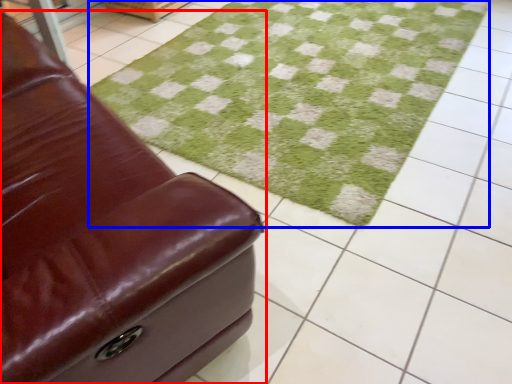
Question: Among these objects, which one is nearest to the camera, furniture (highlighted by a red box) or grass (highlighted by a blue box)?

Choices:
 (A) furniture
 (B) grass

Answer: (A)